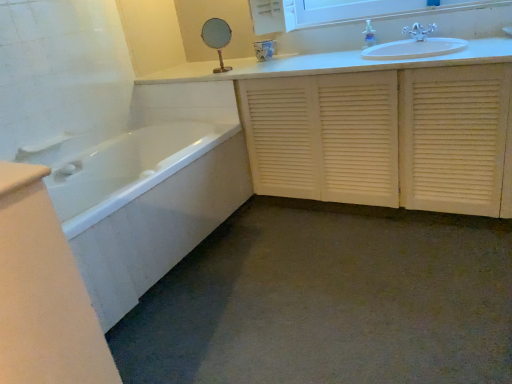
This screenshot has height=384, width=512. What do you see at coordinates (146, 205) in the screenshot? I see `white glossy bathtub at lower left` at bounding box center [146, 205].

In order to face white glossy medicine cabinet at upper center, should I rotate leftwards or rightwards?

You should look right and rotate roughly 17.272 degrees.

Image resolution: width=512 pixels, height=384 pixels. What do you see at coordinates (42, 145) in the screenshot?
I see `white plastic towel bar at left` at bounding box center [42, 145].

Where is `silver metallic faucet at upper right`? The image size is (512, 384). silver metallic faucet at upper right is located at coordinates (419, 31).

What do you see at coordinates (419, 31) in the screenshot? I see `silver metallic faucet at upper right` at bounding box center [419, 31].

Find the location of `white glossy bathtub at lower left`. white glossy bathtub at lower left is located at coordinates (146, 205).

From a real-world perspective, relative to white plastic towel bar at left, is clear plastic soap dispenser at upper center vertically above or below?

clear plastic soap dispenser at upper center is situated higher than white plastic towel bar at left in the real world.

Can you confirm if clear plastic soap dispenser at upper center is positioned to the right of white plastic towel bar at left?

Correct, you'll find clear plastic soap dispenser at upper center to the right of white plastic towel bar at left.

Does clear plastic soap dispenser at upper center have a larger size compared to white plastic towel bar at left?

No.

Is there a large distance between clear plastic soap dispenser at upper center and white plastic towel bar at left?

Yes, clear plastic soap dispenser at upper center is far from white plastic towel bar at left.

From a real-world perspective, is white glossy bathtub at lower left positioned over white glossy medicine cabinet at upper center based on gravity?

Incorrect, from a real-world perspective, white glossy bathtub at lower left is lower than white glossy medicine cabinet at upper center.

Is white glossy bathtub at lower left far away from white glossy medicine cabinet at upper center?

Yes, white glossy bathtub at lower left and white glossy medicine cabinet at upper center are quite far apart.

Considering the relative sizes of white glossy bathtub at lower left and white glossy medicine cabinet at upper center in the image provided, is white glossy bathtub at lower left smaller than white glossy medicine cabinet at upper center?

No.

Is white glossy bathtub at lower left completely or partially outside of white glossy medicine cabinet at upper center?

Absolutely, white glossy bathtub at lower left is external to white glossy medicine cabinet at upper center.

The width and height of the screenshot is (512, 384). Find the location of `medicine cabinet on the right of clear plastic soap dispenser at upper center`. medicine cabinet on the right of clear plastic soap dispenser at upper center is located at coordinates (346, 11).

Is white glossy medicine cabinet at upper center spatially inside clear plastic soap dispenser at upper center, or outside of it?

white glossy medicine cabinet at upper center is spatially situated outside clear plastic soap dispenser at upper center.

Is clear plastic soap dispenser at upper center at the back of white glossy medicine cabinet at upper center?

No, white glossy medicine cabinet at upper center's orientation is not away from clear plastic soap dispenser at upper center.

From the image's perspective, between white glossy medicine cabinet at upper center and clear plastic soap dispenser at upper center, which one is located above?

white glossy medicine cabinet at upper center, from the image's perspective.

Between point (54, 138) and point (323, 93), which one is positioned behind?

The point (54, 138) is more distant.

In the scene shown: From a real-world perspective, is white plastic towel bar at left on white louvered cabinet at center?

Indeed, from a real-world perspective, white plastic towel bar at left stands above white louvered cabinet at center.

Is white plastic towel bar at left not inside white louvered cabinet at center?

white plastic towel bar at left lies outside white louvered cabinet at center's area.

From the picture: Which is less distant, (72, 136) or (367, 19)?

The point (72, 136) is closer.

In the scene shown: Considering the relative positions of white plastic towel bar at left and clear plastic soap dispenser at upper center in the image provided, is white plastic towel bar at left to the right of clear plastic soap dispenser at upper center from the viewer's perspective?

No.

Can we say white plastic towel bar at left lies outside clear plastic soap dispenser at upper center?

Yes, white plastic towel bar at left is outside of clear plastic soap dispenser at upper center.

From the image's perspective, relative to clear plastic soap dispenser at upper center, is white plastic towel bar at left above or below?

From the image's perspective, white plastic towel bar at left appears below clear plastic soap dispenser at upper center.

Find the location of a particular element. This screenshot has height=384, width=512. bathroom cabinet that is under the white glossy medicine cabinet at upper center (from a real-world perspective) is located at coordinates (382, 128).

Is white glossy medicine cabinet at upper center oriented towards white louvered cabinet at center?

No, white glossy medicine cabinet at upper center is not facing towards white louvered cabinet at center.

From the image's perspective, which one is positioned lower, white glossy medicine cabinet at upper center or white louvered cabinet at center?

white louvered cabinet at center.

From the image's perspective, between white glossy bathtub at lower left and silver metallic faucet at upper right, which one is located above?

silver metallic faucet at upper right is shown above in the image.

Which is in front, point (134, 276) or point (422, 30)?

The point (134, 276) is closer to the camera.

Considering the relative sizes of white glossy bathtub at lower left and silver metallic faucet at upper right in the image provided, is white glossy bathtub at lower left smaller than silver metallic faucet at upper right?

No, white glossy bathtub at lower left is not smaller than silver metallic faucet at upper right.

In order to click on towel bar in front of the clear plastic soap dispenser at upper center in this screenshot , I will do coord(42,145).

Find the location of a particular element. medicine cabinet above the white glossy bathtub at lower left (from the image's perspective) is located at coordinates (346, 11).

Which object lies nearer to the anchor point white louvered cabinet at center, clear plastic soap dispenser at upper center or white glossy bathtub at lower left?

clear plastic soap dispenser at upper center is closer to white louvered cabinet at center.

Which object lies further to the anchor point white glossy medicine cabinet at upper center, white glossy bathtub at lower left or white plastic towel bar at left?

white plastic towel bar at left.

When comparing their distances from white plastic towel bar at left, does white louvered cabinet at center or white glossy medicine cabinet at upper center seem further?

white glossy medicine cabinet at upper center is positioned further to the anchor white plastic towel bar at left.

Considering their positions, is white glossy medicine cabinet at upper center positioned further to white louvered cabinet at center than silver metallic faucet at upper right?

silver metallic faucet at upper right lies further to white louvered cabinet at center than the other object.

From the image, which object appears to be nearer to silver metallic faucet at upper right, white plastic towel bar at left or white glossy bathtub at lower left?

white glossy bathtub at lower left.

Estimate the real-world distances between objects in this image. Which object is further from white glossy medicine cabinet at upper center, white louvered cabinet at center or white glossy bathtub at lower left?

white glossy bathtub at lower left lies further to white glossy medicine cabinet at upper center than the other object.

From the image, which object appears to be farther from silver metallic faucet at upper right, white glossy bathtub at lower left or clear plastic soap dispenser at upper center?

Based on the image, white glossy bathtub at lower left appears to be further to silver metallic faucet at upper right.

Considering their positions, is white glossy bathtub at lower left positioned further to white plastic towel bar at left than clear plastic soap dispenser at upper center?

Based on the image, clear plastic soap dispenser at upper center appears to be further to white plastic towel bar at left.

Find the location of a particular element. Image resolution: width=512 pixels, height=384 pixels. tap located between white louvered cabinet at center and clear plastic soap dispenser at upper center in the depth direction is located at coordinates (419, 31).

Locate an element on the screen. toiletry located between white plastic towel bar at left and white louvered cabinet at center in the left-right direction is located at coordinates (369, 35).

What are the coordinates of `medicine cabinet between white glossy bathtub at lower left and silver metallic faucet at upper right in the horizontal direction` in the screenshot? It's located at (346, 11).

Identify the location of toiletry between white glossy bathtub at lower left and white louvered cabinet at center. This screenshot has width=512, height=384. (369, 35).